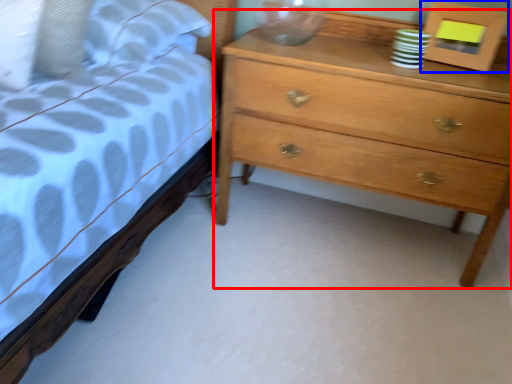
Question: Which object is closer to the camera taking this photo, chest of drawers (highlighted by a red box) or picture frame (highlighted by a blue box)?

Choices:
 (A) chest of drawers
 (B) picture frame

Answer: (A)